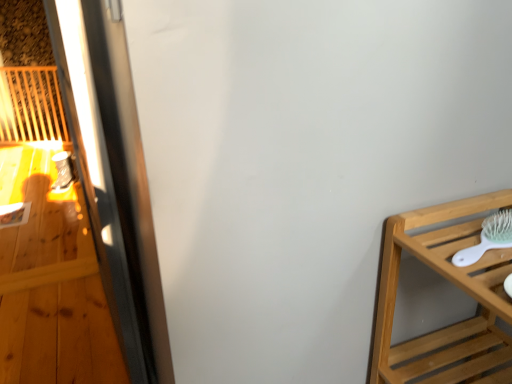
Locate an element on the screen. The image size is (512, 384). free region on the left part of white plastic brush at right is located at coordinates (425, 236).